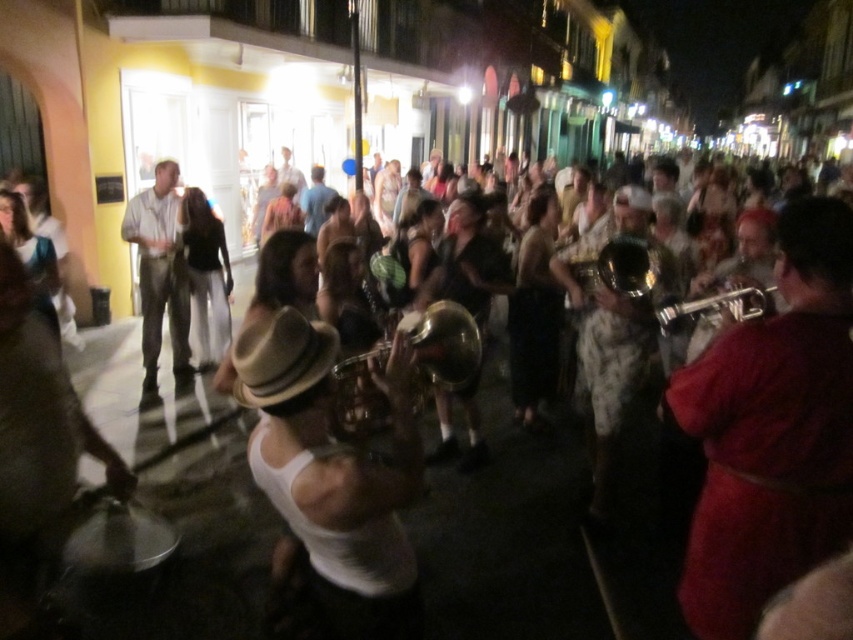
You are a photographer standing at the back of the street scene. You want to take a photo of the shiny brass trumpet at center without the light brown corduroy pants at left blocking it. Is the trumpet visible from your current position?

The shiny brass trumpet at center is behind the light brown corduroy pants at left, so it might be partially or fully blocked from your viewpoint. Adjust your position to ensure the trumpet is in front of the pants for a clear shot.

You are a photographer trying to capture the musician playing the shiny brass trumpet at center. Since the blue denim shirt at center is closer to the camera, will the trumpet be partially hidden by the shirt?

The shiny brass trumpet at center has a smaller size compared to blue denim shirt at center. However, the question states that the blue denim shirt is closer to the camera, so the trumpet might be partially hidden depending on their positions. But according to the description, the trumpet is smaller, not necessarily behind. The answer should strictly use the given info without assumptions. Since the description only mentions size, not depth, we can only confirm their sizes, not occlusion. Thus, the answer